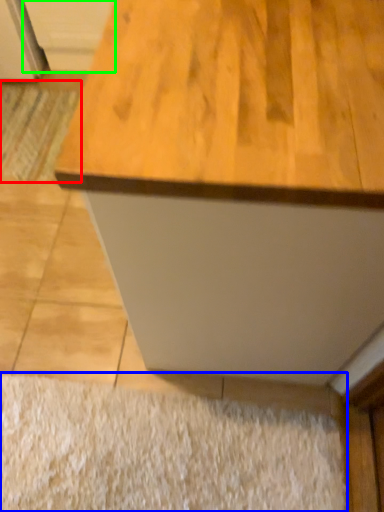
Question: Estimate the real-world distances between objects in this image. Which object is farther from doormat (highlighted by a red box), doormat (highlighted by a blue box) or cabinetry (highlighted by a green box)?

Choices:
 (A) doormat
 (B) cabinetry

Answer: (A)